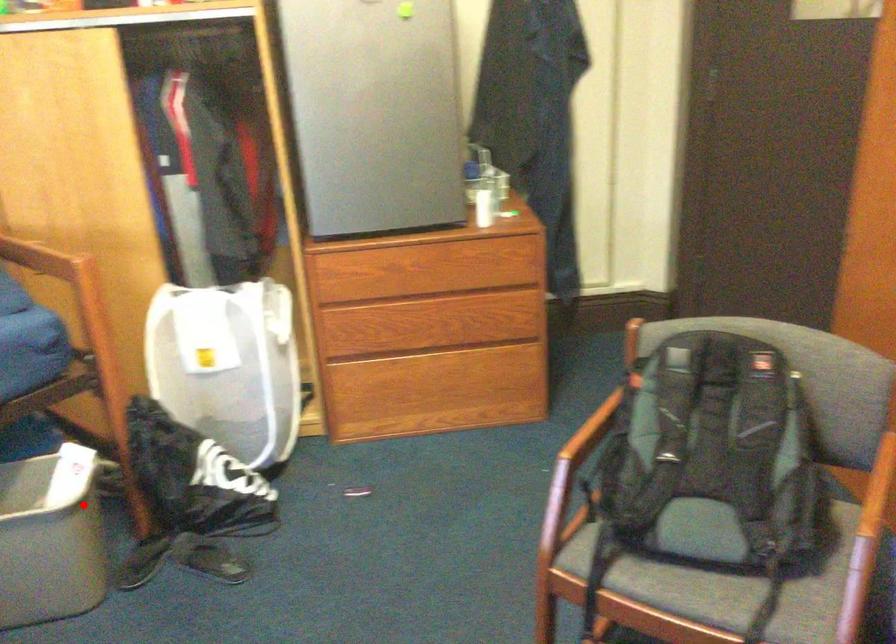
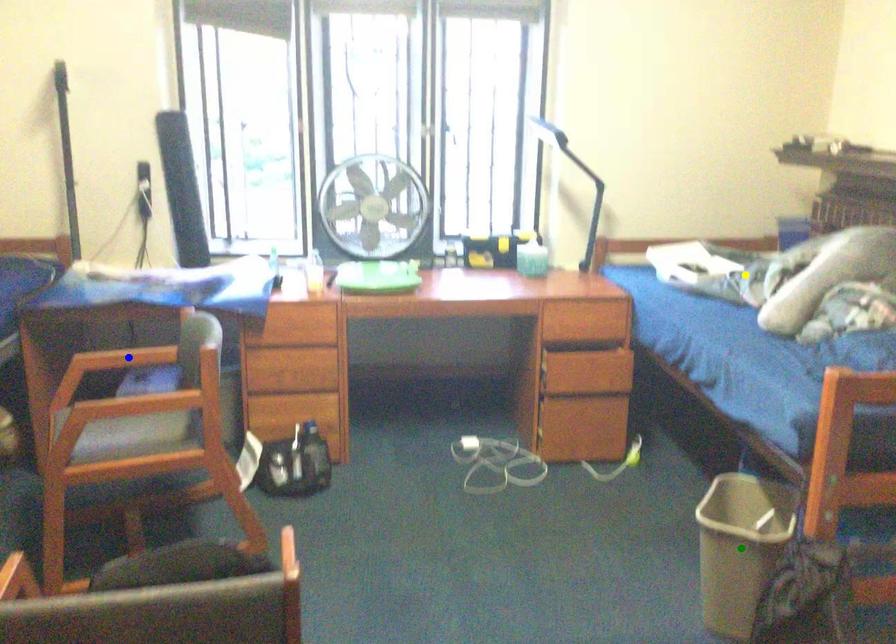
Question: I am providing you with two images of the same scene from different viewpoints. A red point is marked on the first image. You are given multiple points on the second image. Which mark in image 2 goes with the point in image 1?

Choices:
 (A) yellow point
 (B) blue point
 (C) green point

Answer: (C)